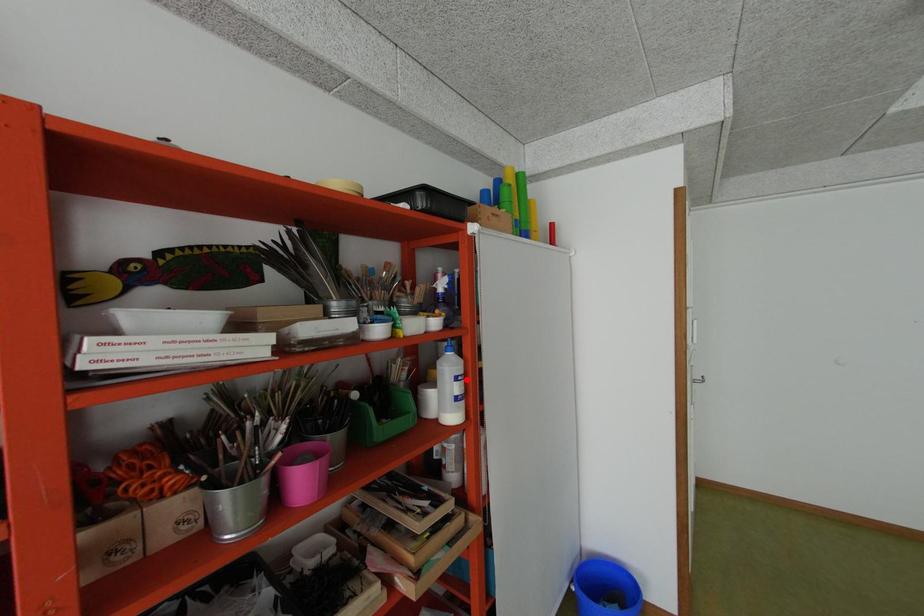
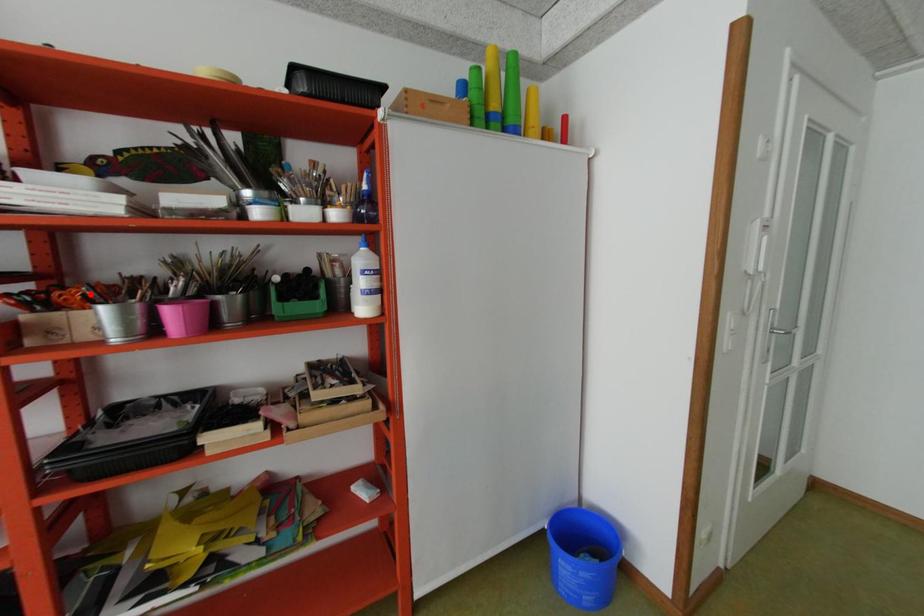
I am providing you with two images of the same scene from different viewpoints. A red point is marked on the first image and another point is marked on the second image. Is the marked point in image1 the same physical position as the marked point in image2?

No